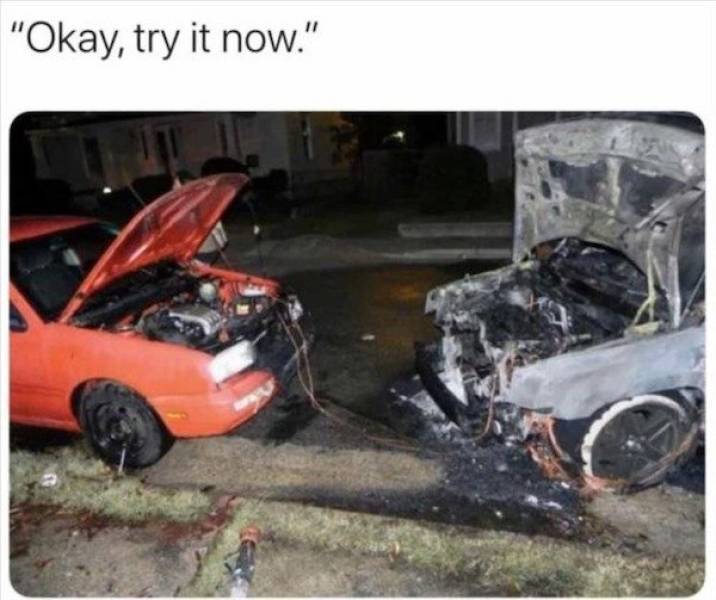
Find the location of a particular element. windows is located at coordinates (162, 148), (221, 138), (493, 132).